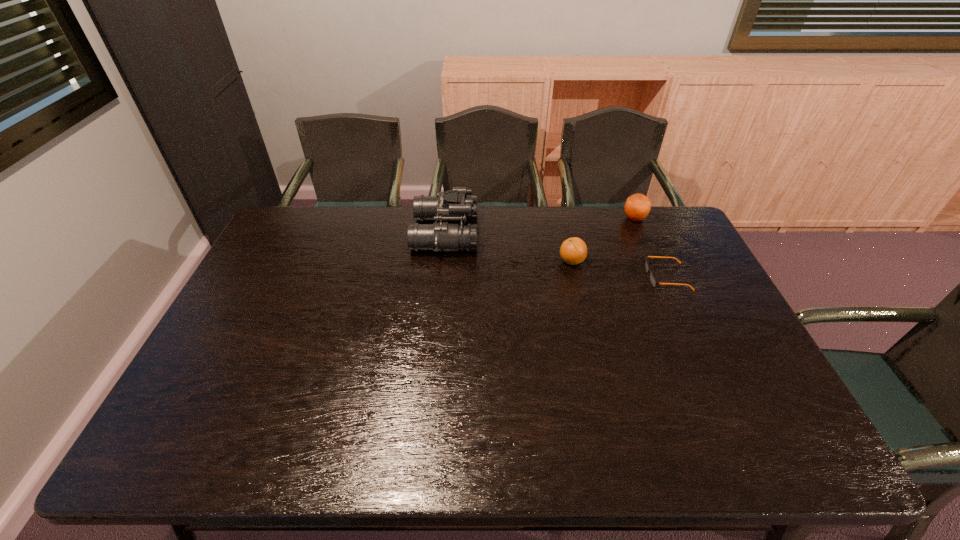
Locate an element on the screen. This screenshot has width=960, height=540. empty space between the tallest object and the shortest object is located at coordinates (556, 255).

Locate an element on the screen. The height and width of the screenshot is (540, 960). vacant area between the spectacles and the right orange is located at coordinates (651, 248).

Where is `object identified as the closest to the leftmost object`? The image size is (960, 540). object identified as the closest to the leftmost object is located at coordinates (573, 250).

Point out which object is positioned as the third nearest to the farther orange. Please provide its 2D coordinates. Your answer should be formatted as a tuple, i.e. [(x, y)], where the tuple contains the x and y coordinates of a point satisfying the conditions above.

[(454, 205)]

This screenshot has width=960, height=540. Identify the location of vacant region that satisfies the following two spatial constraints: 1. through the lenses of the left orange; 2. on the right side of the leftmost object. point(443,261).

Where is `vacant position in the image that satisfies the following two spatial constraints: 1. through the lenses of the third tallest object; 2. on the right side of the tallest object`? Image resolution: width=960 pixels, height=540 pixels. vacant position in the image that satisfies the following two spatial constraints: 1. through the lenses of the third tallest object; 2. on the right side of the tallest object is located at coordinates [443, 261].